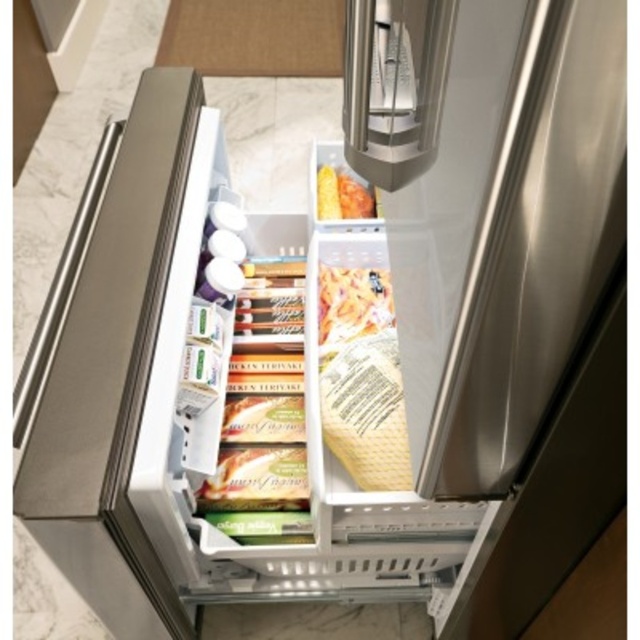
Can you confirm if translucent plastic bag of pasta at center is smaller than matte orange corn at center?

No, translucent plastic bag of pasta at center is not smaller than matte orange corn at center.

Between translucent plastic bag of pasta at center and matte orange corn at center, which one appears on the right side from the viewer's perspective?

From the viewer's perspective, translucent plastic bag of pasta at center appears more on the right side.

This screenshot has width=640, height=640. What do you see at coordinates (362, 378) in the screenshot?
I see `translucent plastic bag of pasta at center` at bounding box center [362, 378].

The height and width of the screenshot is (640, 640). In order to click on translucent plastic bag of pasta at center in this screenshot , I will do `click(362, 378)`.